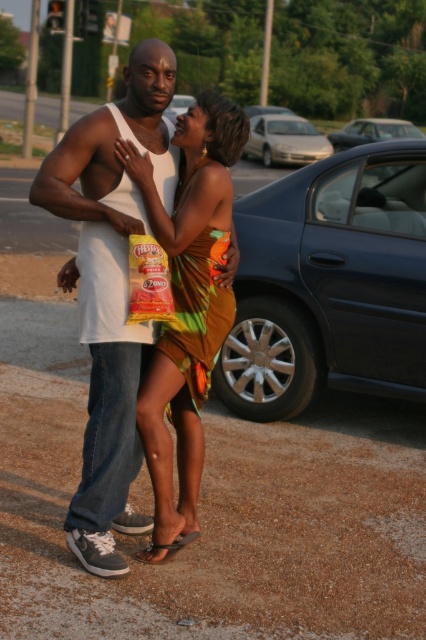
Question: Among these points, which one is nearest to the camera?

Choices:
 (A) click(252, 134)
 (B) click(169, 118)

Answer: (B)

Question: Does shiny orange dress at center come behind silver metallic sedan at center?

Choices:
 (A) no
 (B) yes

Answer: (A)

Question: Is the position of metallic blue sedan at right more distant than that of shiny orange dress at center?

Choices:
 (A) no
 (B) yes

Answer: (B)

Question: Among these objects, which one is farthest from the camera?

Choices:
 (A) blue metallic car at center
 (B) shiny orange dress at center
 (C) metallic blue sedan at right
 (D) silver metallic sedan at center

Answer: (C)

Question: Which of the following is the farthest from the observer?

Choices:
 (A) shiny orange dress at center
 (B) blue metallic car at center

Answer: (B)

Question: Does metallic blue sedan at right have a larger size compared to blue metallic car at center?

Choices:
 (A) yes
 (B) no

Answer: (B)